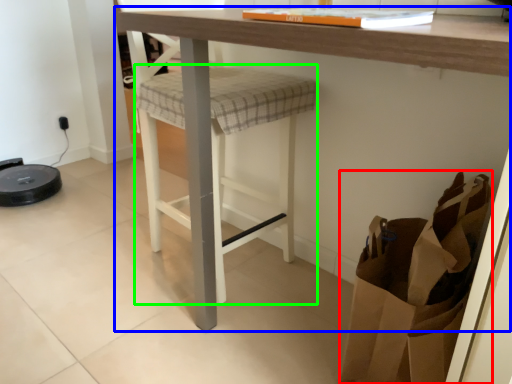
Question: Considering the real-world distances, which object is closest to shopping bag (highlighted by a red box)? table (highlighted by a blue box) or step stool (highlighted by a green box).

Choices:
 (A) table
 (B) step stool

Answer: (A)